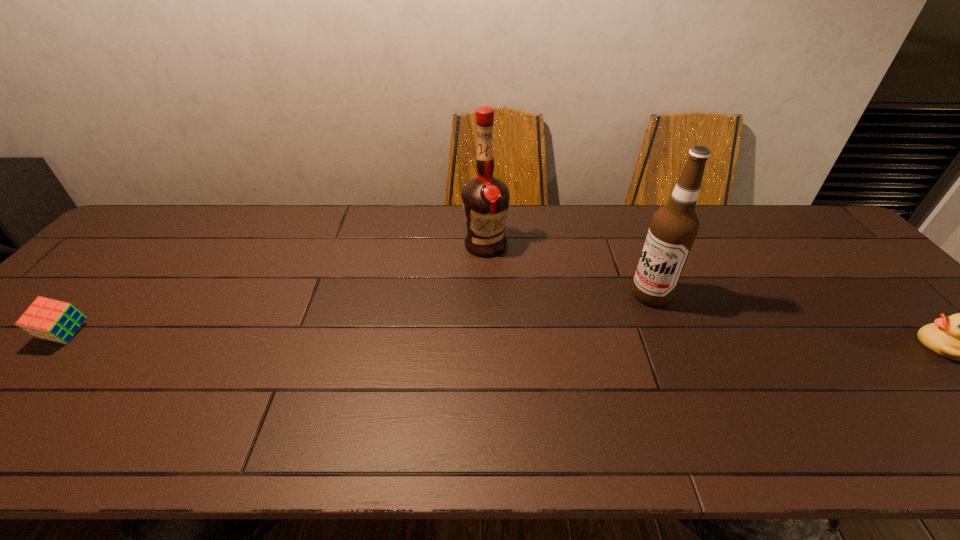
Locate an element on the screen. The width and height of the screenshot is (960, 540). free space between the third nearest object and the third object from right to left is located at coordinates (567, 270).

The width and height of the screenshot is (960, 540). I want to click on blank region between the farthest object and the cube, so click(x=276, y=290).

Locate an element on the screen. Image resolution: width=960 pixels, height=540 pixels. free spot between the third nearest object and the cube is located at coordinates (358, 315).

The width and height of the screenshot is (960, 540). What are the coordinates of `free area in between the farthest object and the cube` in the screenshot? It's located at (276, 290).

The width and height of the screenshot is (960, 540). I want to click on free spot between the third object from left to right and the leftmost object, so click(358, 315).

The height and width of the screenshot is (540, 960). Find the location of `free space between the cube and the farthest object`. free space between the cube and the farthest object is located at coordinates point(276,290).

The width and height of the screenshot is (960, 540). In order to click on object that is the nearest to the rightmost object in this screenshot , I will do `click(673, 229)`.

Where is `object that stands as the closest to the duckling`? This screenshot has height=540, width=960. object that stands as the closest to the duckling is located at coordinates (673, 229).

Image resolution: width=960 pixels, height=540 pixels. In order to click on free location that satisfies the following two spatial constraints: 1. on the front side of the farthest object; 2. on the right side of the second object from right to left in this screenshot , I will do `click(486, 295)`.

Where is `free spot that satisfies the following two spatial constraints: 1. on the back side of the leftmost object; 2. on the right side of the farthest object`? Image resolution: width=960 pixels, height=540 pixels. free spot that satisfies the following two spatial constraints: 1. on the back side of the leftmost object; 2. on the right side of the farthest object is located at coordinates (148, 245).